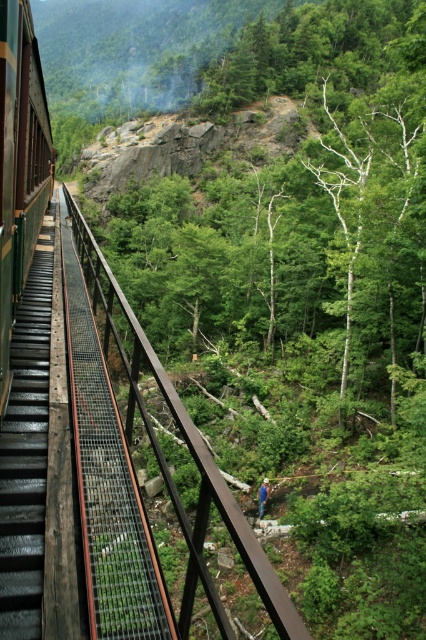
Question: Which object is farther from the camera taking this photo?

Choices:
 (A) brown metal rail at center
 (B) blue denim jeans at center

Answer: (B)

Question: Which object is the farthest from the wooden stairs at left?

Choices:
 (A) brown metal rail at center
 (B) blue denim jeans at center

Answer: (B)

Question: Which object is the farthest from the wooden stairs at left?

Choices:
 (A) blue denim jeans at center
 (B) brown metal rail at center

Answer: (A)

Question: Can you confirm if brown metal rail at center is positioned below wooden stairs at left?

Choices:
 (A) no
 (B) yes

Answer: (B)

Question: Can you confirm if wooden stairs at left is positioned below blue denim jeans at center?

Choices:
 (A) no
 (B) yes

Answer: (A)

Question: Does brown metal rail at center appear on the left side of wooden stairs at left?

Choices:
 (A) no
 (B) yes

Answer: (A)